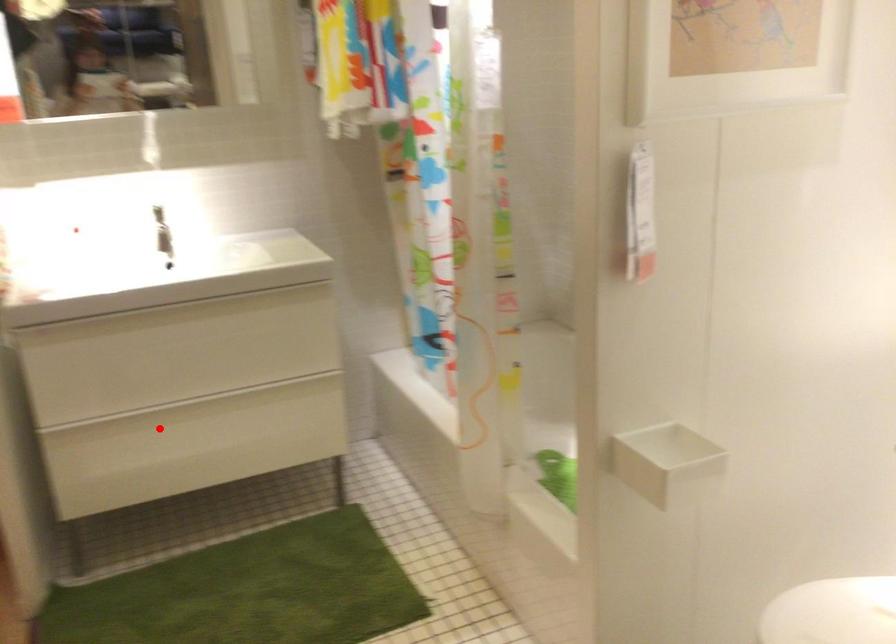
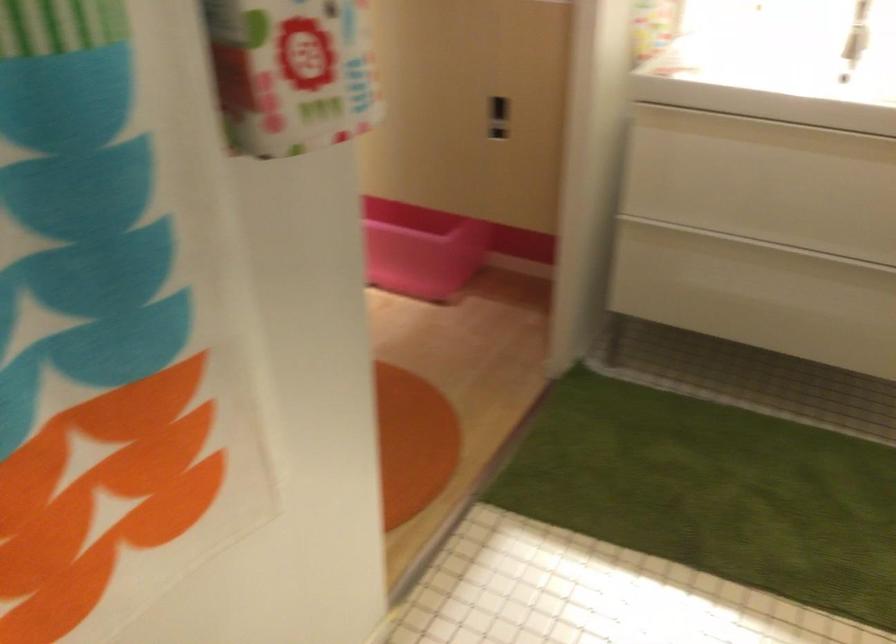
Question: I am providing you with two images of the same scene from different viewpoints. Given a red point in image1, look at the same physical point in image2. Is it:

Choices:
 (A) Closer to the viewpoint
 (B) Farther from the viewpoint

Answer: (A)